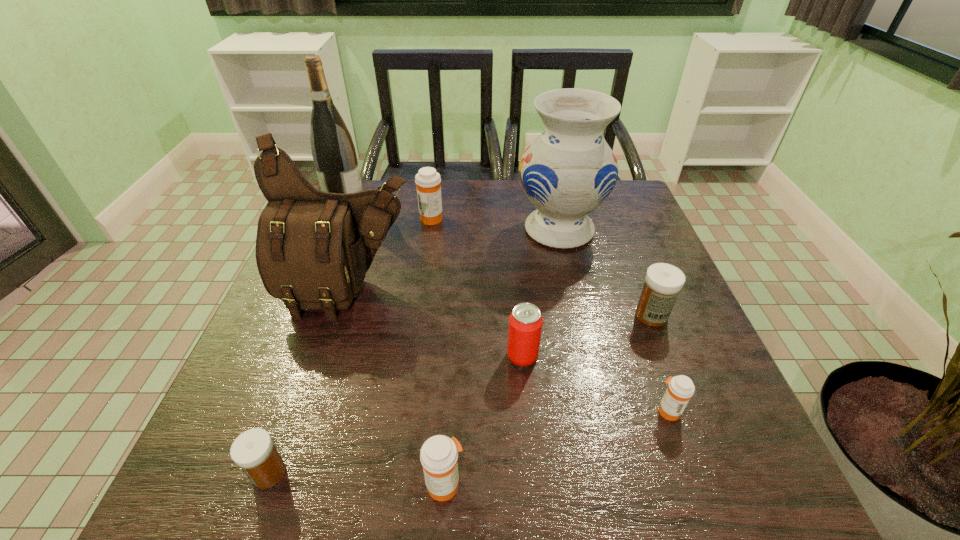
Locate an element on the screen. The width and height of the screenshot is (960, 540). vacant area between the brown wine bottle and the left white medicine is located at coordinates (307, 338).

Locate an element on the screen. The width and height of the screenshot is (960, 540). empty space that is in between the fourth nearest object and the red vase is located at coordinates (540, 293).

Where is `free space between the brown shoulder bag and the beer can`? The image size is (960, 540). free space between the brown shoulder bag and the beer can is located at coordinates click(436, 324).

Where is `free spot between the vase and the second biggest orange medicine`? This screenshot has width=960, height=540. free spot between the vase and the second biggest orange medicine is located at coordinates (502, 357).

Find the location of a particular element. free space that is in between the right white medicine and the third farthest medicine is located at coordinates (660, 363).

You are a GUI agent. You are given a task and a screenshot of the screen. Output one action in this format:
    pyautogui.click(x=<x>, y=<y>)
    Task: Click on the vacant area that lies between the smallest orange medicine and the farther white medicine
    Image resolution: width=960 pixels, height=540 pixels.
    Given the screenshot: What is the action you would take?
    pyautogui.click(x=660, y=363)

Where is `free spot between the fifth object from right to left and the bigger white medicine`? The image size is (960, 540). free spot between the fifth object from right to left and the bigger white medicine is located at coordinates (548, 400).

Find the location of `free space between the sixth farthest object and the red vase`. free space between the sixth farthest object and the red vase is located at coordinates (540, 293).

In order to click on empty location between the red vase and the farthest orange medicine in this screenshot , I will do point(495,224).

Locate an element on the screen. the sixth closest object to the shoulder bag is located at coordinates click(x=439, y=454).